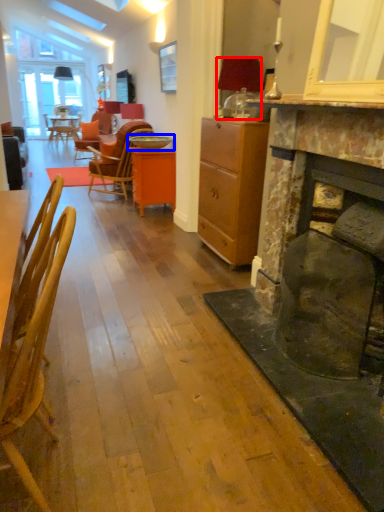
Question: Which of the following is the farthest to the observer, lamp (highlighted by a red box) or round table (highlighted by a blue box)?

Choices:
 (A) lamp
 (B) round table

Answer: (B)